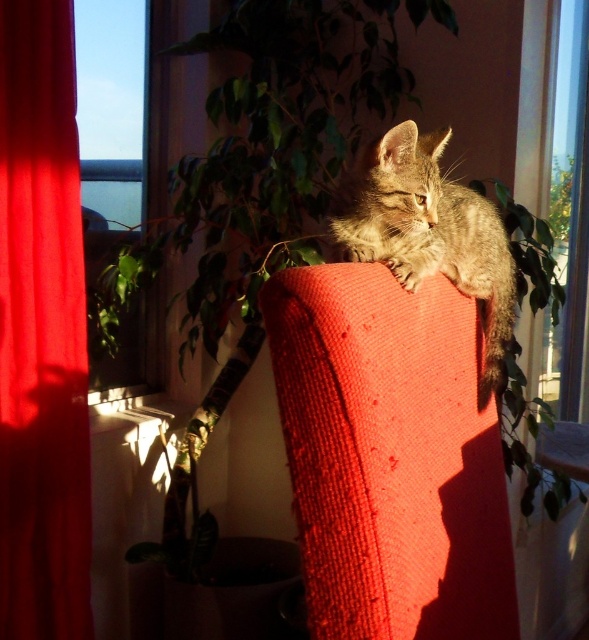
What object is located at the coordinates point (256, 195)?

The point (256, 195) indicates the green leafy plant at upper center.

You are standing in the room and want to reach the point marked at coordinates [181,323]. The red upholstered chair with the tabby kitten is between you and that point. Can you walk around the chair to reach the point without disturbing the kitten?

The point marked at coordinates [181,323] is 6.04 feet away from the viewer. Since the red upholstered chair with the tabby kitten is between you and the point, you can walk around the chair to reach the point without disturbing the kitten as long as there is enough space around the chair to maneuver.

You are a cat owner who wants to place a new toy for your kitten. The toy needs to be placed where it can be seen from both the green leafy plant at upper center and the transparent glass window at upper left. Considering their sizes, which object should the toy be closer to?

The green leafy plant at upper center is wider than the transparent glass window at upper left. Therefore, the toy should be placed closer to the green leafy plant at upper center to ensure visibility from both locations.